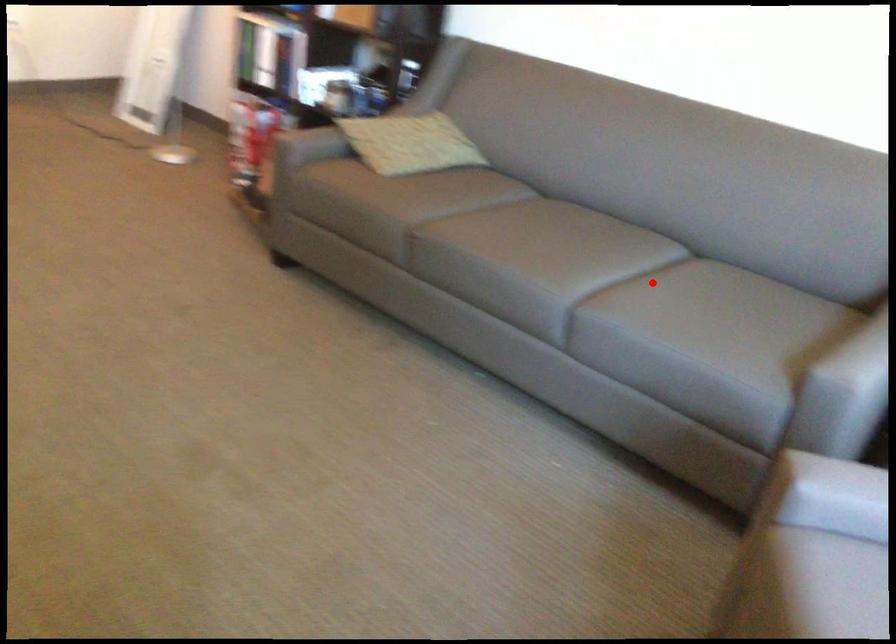
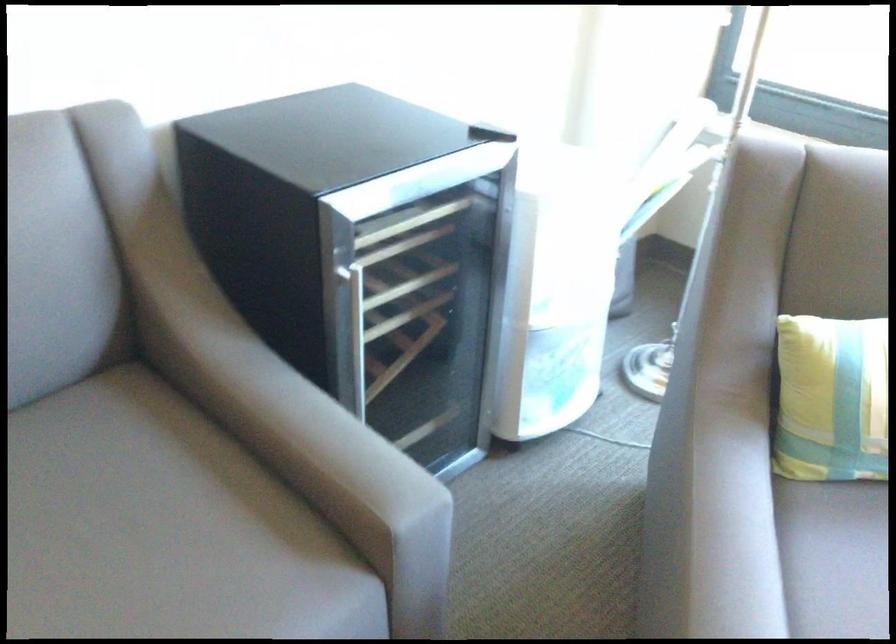
Where in the second image is the point corresponding to the highlighted location from the first image?

(83, 529)